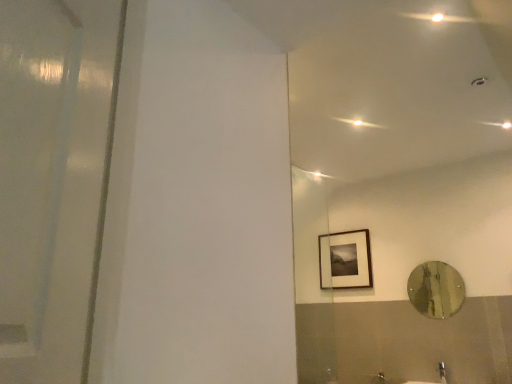
Find the location of a particular element. Image resolution: width=512 pixels, height=384 pixels. matte black picture frame at upper right is located at coordinates (345, 260).

What is the approximate height of metallic reflective mirror at right?

metallic reflective mirror at right is 48.58 centimeters in height.

Where is `satin nickel faucet at lower right`? The height and width of the screenshot is (384, 512). satin nickel faucet at lower right is located at coordinates (442, 373).

Who is shorter, metallic reflective mirror at right or satin nickel faucet at lower right?

satin nickel faucet at lower right is shorter.

Looking at this image, which object is further away from the camera, metallic reflective mirror at right or satin nickel faucet at lower right?

metallic reflective mirror at right is further away from the camera.

Is metallic reflective mirror at right to the right of satin nickel faucet at lower right from the viewer's perspective?

Yes.

Is metallic reflective mirror at right oriented towards satin nickel faucet at lower right?

No, metallic reflective mirror at right is not facing towards satin nickel faucet at lower right.

What's the angular difference between satin nickel faucet at lower right and metallic reflective mirror at right's facing directions?

0.00726 degrees separate the facing orientations of satin nickel faucet at lower right and metallic reflective mirror at right.

There is a satin nickel faucet at lower right. Identify the location of mirror above it (from a real-world perspective). (436, 289).

Are satin nickel faucet at lower right and metallic reflective mirror at right beside each other?

satin nickel faucet at lower right and metallic reflective mirror at right are clearly separated.

Is satin nickel faucet at lower right positioned with its back to metallic reflective mirror at right?

That's not correct — satin nickel faucet at lower right is not looking away from metallic reflective mirror at right.

Is matte black picture frame at upper right completely or partially inside metallic reflective mirror at right?

No, matte black picture frame at upper right is not inside metallic reflective mirror at right.

Is metallic reflective mirror at right at the right side of matte black picture frame at upper right?

Yes, metallic reflective mirror at right is to the right of matte black picture frame at upper right.

How much distance is there between metallic reflective mirror at right and matte black picture frame at upper right?

metallic reflective mirror at right and matte black picture frame at upper right are 68.32 centimeters apart from each other.

Is the depth of metallic reflective mirror at right greater than that of matte black picture frame at upper right?

No, the depth of metallic reflective mirror at right is less than that of matte black picture frame at upper right.

Which of these two, matte black picture frame at upper right or satin nickel faucet at lower right, is bigger?

matte black picture frame at upper right is bigger.

Is matte black picture frame at upper right in front of satin nickel faucet at lower right?

No, it is behind satin nickel faucet at lower right.

Is matte black picture frame at upper right with satin nickel faucet at lower right?

matte black picture frame at upper right and satin nickel faucet at lower right are clearly separated.

From a real-world perspective, which is physically above, matte black picture frame at upper right or satin nickel faucet at lower right?

matte black picture frame at upper right, from a real-world perspective.

Consider the image. Is matte black picture frame at upper right bigger than metallic reflective mirror at right?

Correct, matte black picture frame at upper right is larger in size than metallic reflective mirror at right.

Does matte black picture frame at upper right have a lesser width compared to metallic reflective mirror at right?

No, matte black picture frame at upper right is not thinner than metallic reflective mirror at right.

Which object is positioned more to the left, matte black picture frame at upper right or metallic reflective mirror at right?

matte black picture frame at upper right is more to the left.

In the scene shown: From a real-world perspective, is satin nickel faucet at lower right below matte black picture frame at upper right?

Yes, from a real-world perspective, satin nickel faucet at lower right is beneath matte black picture frame at upper right.

From the image's perspective, between satin nickel faucet at lower right and matte black picture frame at upper right, which one is located above?

matte black picture frame at upper right is shown above in the image.

Is satin nickel faucet at lower right shorter than matte black picture frame at upper right?

Yes, satin nickel faucet at lower right is shorter than matte black picture frame at upper right.

The height and width of the screenshot is (384, 512). Find the location of `mirror behind the satin nickel faucet at lower right`. mirror behind the satin nickel faucet at lower right is located at coordinates (436, 289).

Identify the location of mirror that is above the satin nickel faucet at lower right (from a real-world perspective). (436, 289).

Considering their positions, is metallic reflective mirror at right positioned closer to matte black picture frame at upper right than satin nickel faucet at lower right?

metallic reflective mirror at right lies closer to matte black picture frame at upper right than the other object.

Estimate the real-world distances between objects in this image. Which object is further from satin nickel faucet at lower right, matte black picture frame at upper right or metallic reflective mirror at right?

Based on the image, matte black picture frame at upper right appears to be further to satin nickel faucet at lower right.

Based on the photo, looking at the image, which one is located further to metallic reflective mirror at right, matte black picture frame at upper right or satin nickel faucet at lower right?

Based on the image, matte black picture frame at upper right appears to be further to metallic reflective mirror at right.

Looking at the image, which one is located closer to matte black picture frame at upper right, satin nickel faucet at lower right or metallic reflective mirror at right?

metallic reflective mirror at right lies closer to matte black picture frame at upper right than the other object.

When comparing their distances from satin nickel faucet at lower right, does metallic reflective mirror at right or matte black picture frame at upper right seem further?

matte black picture frame at upper right is further to satin nickel faucet at lower right.

Looking at the image, which one is located closer to metallic reflective mirror at right, satin nickel faucet at lower right or matte black picture frame at upper right?

Based on the image, satin nickel faucet at lower right appears to be nearer to metallic reflective mirror at right.

At what (x,y) coordinates should I click in order to perform the action: click on mirror between matte black picture frame at upper right and satin nickel faucet at lower right vertically. Please return your answer as a coordinate pair (x, y). Image resolution: width=512 pixels, height=384 pixels. Looking at the image, I should click on 436,289.